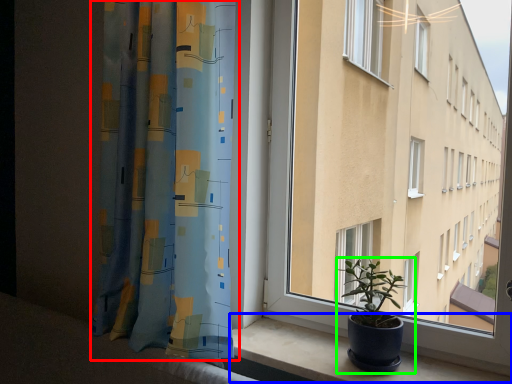
Question: Estimate the real-world distances between objects in this image. Which object is farther from curtain (highlighted by a red box), window sill (highlighted by a blue box) or houseplant (highlighted by a green box)?

Choices:
 (A) window sill
 (B) houseplant

Answer: (B)